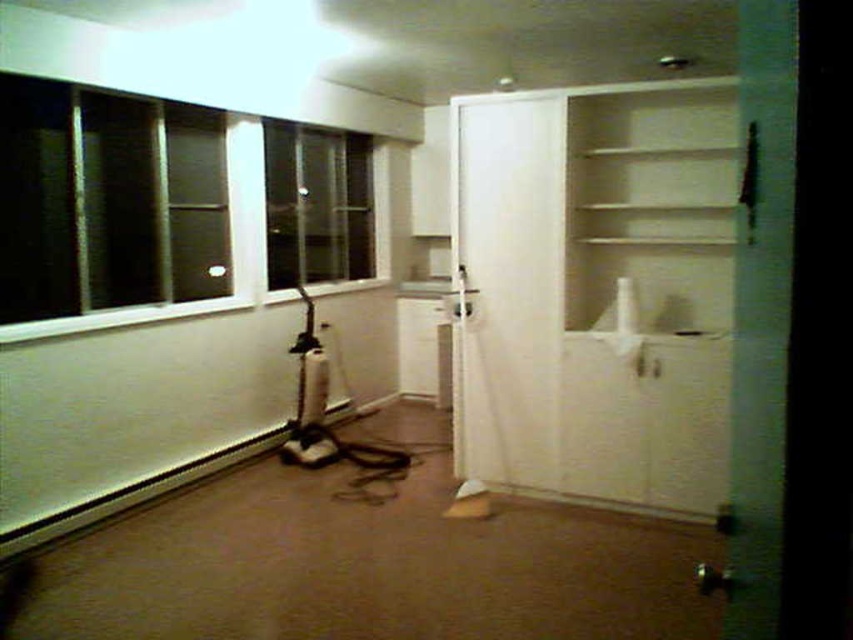
Is point (190, 202) positioned before point (357, 150)?

Yes, point (190, 202) is closer to viewer.

Is dark glass window at left wider than clear glass window at upper left?

Yes.

Does point (32, 314) come in front of point (369, 163)?

Yes, it is in front of point (369, 163).

Identify the location of dark glass window at left. (106, 205).

Which is behind, point (712, 428) or point (271, 120)?

Positioned behind is point (271, 120).

Is white matte cabinet at center taller than clear glass window at upper left?

Yes.

This screenshot has width=853, height=640. Find the location of `white matte cabinet at center`. white matte cabinet at center is located at coordinates (596, 291).

The height and width of the screenshot is (640, 853). Find the location of `white matte cabinet at center`. white matte cabinet at center is located at coordinates (596, 291).

You are a GUI agent. You are given a task and a screenshot of the screen. Output one action in this format:
    pyautogui.click(x=<x>, y=<y>)
    Task: Click on the white matte cabinet at center
    The height and width of the screenshot is (640, 853).
    Given the screenshot: What is the action you would take?
    pyautogui.click(x=596, y=291)